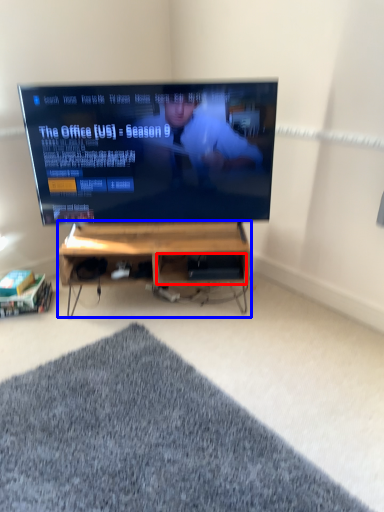
Question: Which object appears farthest to the camera in this image, shelf (highlighted by a red box) or desk (highlighted by a blue box)?

Choices:
 (A) shelf
 (B) desk

Answer: (A)